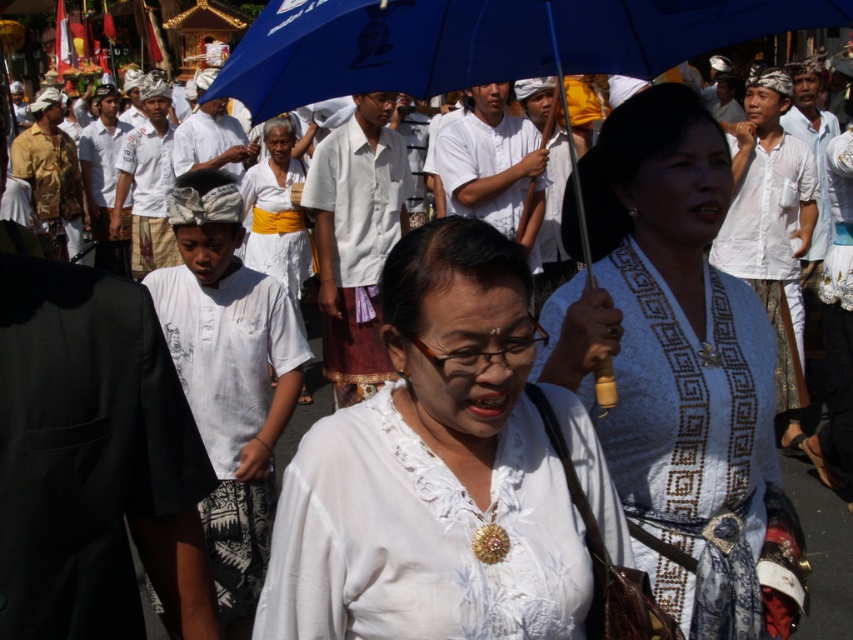
Is white woven fabric at center bigger than blue fabric umbrella at upper center?

Yes.

Who is higher up, white woven fabric at center or blue fabric umbrella at upper center?

blue fabric umbrella at upper center is higher up.

Identify the location of white woven fabric at center. The width and height of the screenshot is (853, 640). (674, 358).

Does white woven fabric at center appear on the left side of white cotton dress at center?

No, white woven fabric at center is not to the left of white cotton dress at center.

Measure the distance from white woven fabric at center to white cotton dress at center.

white woven fabric at center and white cotton dress at center are 5.50 meters apart from each other.

What are the coordinates of `white woven fabric at center` in the screenshot? It's located at (674, 358).

I want to click on white lace blouse at center, so click(434, 472).

Can you confirm if white lace blouse at center is taller than white cotton dress at center?

No, white lace blouse at center is not taller than white cotton dress at center.

This screenshot has width=853, height=640. What are the coordinates of `white lace blouse at center` in the screenshot? It's located at (434, 472).